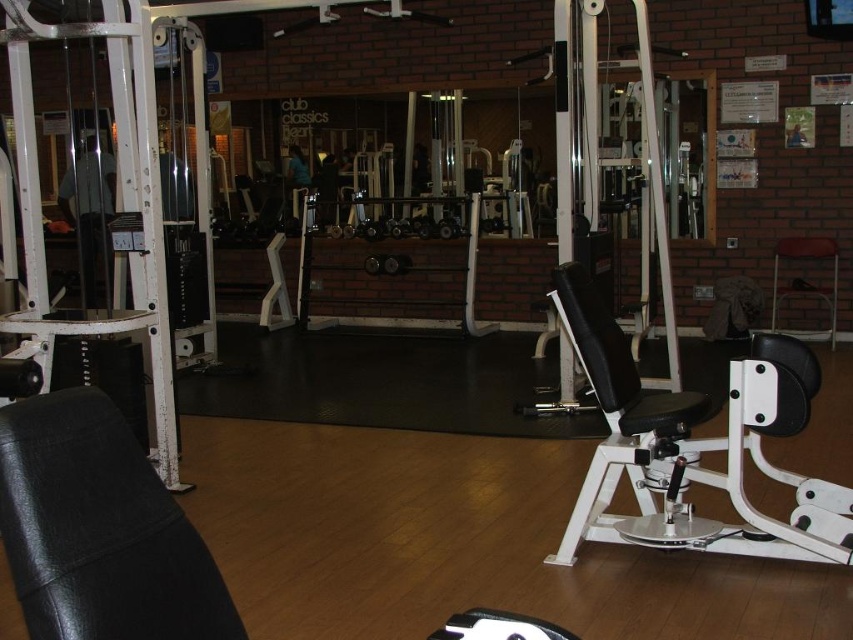
In the scene shown: You are a gym member who wants to use the equipment closest to you. You see the white plastic weight bench at right and the metallic stool at right. Which one should you approach first?

The white plastic weight bench at right is closer to the viewer than the metallic stool at right, so you should approach the white plastic weight bench at right first.

You are a gym trainer setting up an exercise area for a client. You have a white plastic weight bench at right and a metallic stool at right. The client needs to place these items side by side along a 2.5 meter long wall. Can both items fit if placed next to each other?

The white plastic weight bench at right is wider than the metallic stool at right. However, without knowing their exact widths, it is impossible to determine if both will fit within the 2.5 meter wall space.